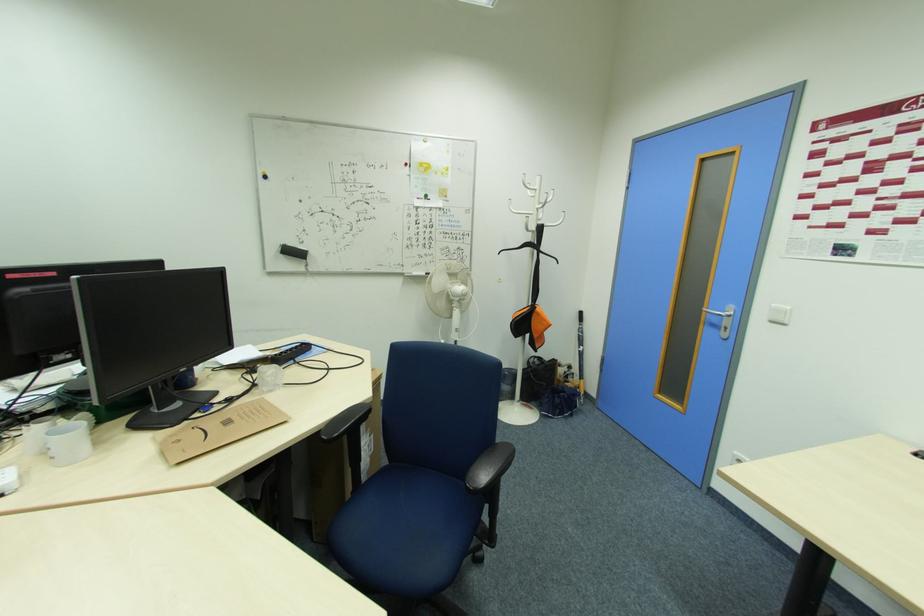
Where is `chair sitting surface`? This screenshot has width=924, height=616. chair sitting surface is located at coordinates (408, 507).